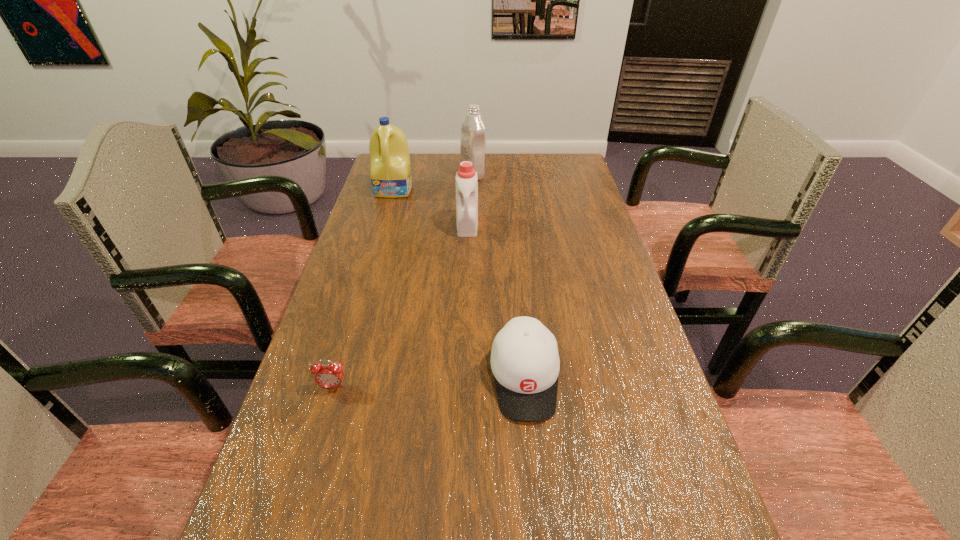
Identify the location of detergent that is at the left edge. The width and height of the screenshot is (960, 540). (391, 177).

You are a GUI agent. You are given a task and a screenshot of the screen. Output one action in this format:
    pyautogui.click(x=<x>, y=<y>)
    Task: Click on the alarm clock positioned at the left edge
    
    Given the screenshot: What is the action you would take?
    pyautogui.click(x=327, y=375)

The width and height of the screenshot is (960, 540). Find the location of `object that is at the far left corner`. object that is at the far left corner is located at coordinates (391, 177).

The height and width of the screenshot is (540, 960). I want to click on vacant space at the far edge of the desktop, so click(x=430, y=164).

This screenshot has height=540, width=960. Find the location of `vacant space at the left edge`. vacant space at the left edge is located at coordinates (340, 346).

What are the coordinates of `free spot at the right edge of the desktop` in the screenshot? It's located at (579, 215).

This screenshot has width=960, height=540. Identify the location of free spot at the far right corner of the desktop. (566, 178).

The image size is (960, 540). I want to click on free space between the leftmost detergent and the baseball cap, so click(x=460, y=284).

You are a GUI agent. You are given a task and a screenshot of the screen. Output one action in this format:
    pyautogui.click(x=<x>, y=<y>)
    Task: Click on the vacant area between the shortest detergent and the fourth tallest object
    Image resolution: width=960 pixels, height=540 pixels.
    Given the screenshot: What is the action you would take?
    pyautogui.click(x=496, y=301)

Image resolution: width=960 pixels, height=540 pixels. I want to click on free space between the baseball cap and the alarm clock, so click(429, 382).